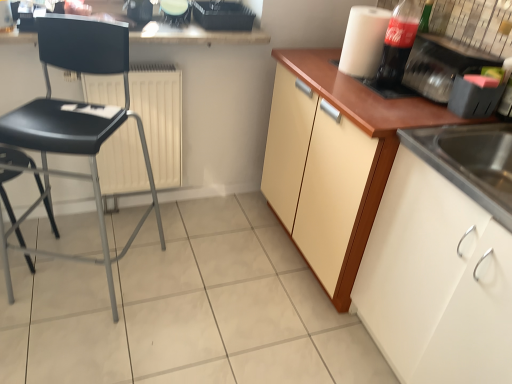
You are a GUI agent. You are given a task and a screenshot of the screen. Output one action in this format:
    pyautogui.click(x=<x>, y=<y>)
    Task: Click on the free point below black plastic chair at left, placed as the first chair when sorted from right to left (from a real-world perspective)
    The width and height of the screenshot is (512, 384).
    Given the screenshot: What is the action you would take?
    pyautogui.click(x=106, y=284)